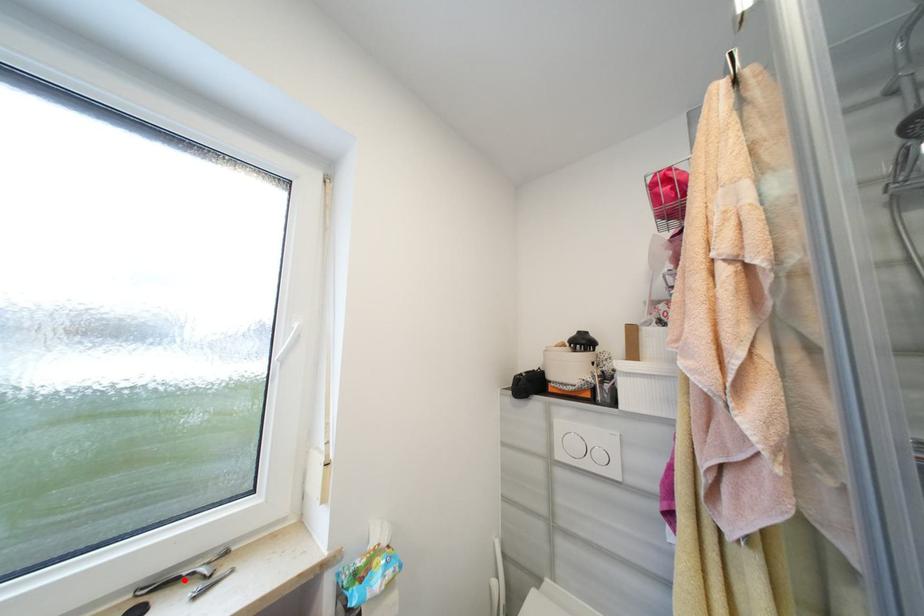
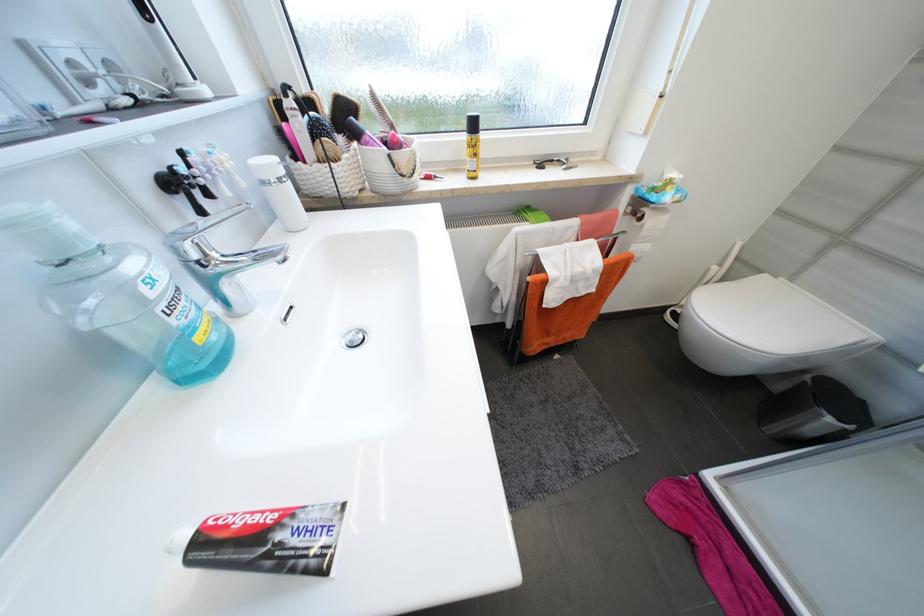
Locate, in the second image, the point that corresponds to the highlighted location in the first image.

(558, 161)